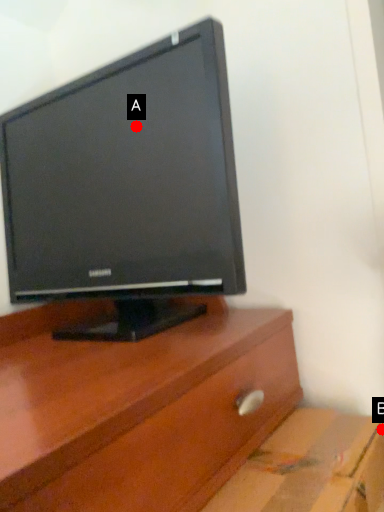
Question: Two points are circled on the image, labeled by A and B beside each circle. Which point is farther from the camera taking this photo?

Choices:
 (A) A is further
 (B) B is further

Answer: (A)